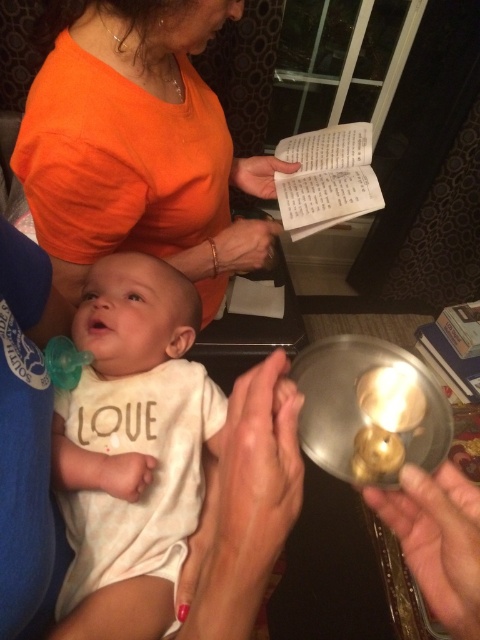
You are a photographer setting up a shot of the scene described. You need to position a light source to the right of the metallic gold ring at lower right to highlight it. Will the light also illuminate the white soft cotton onesie at center?

The white soft cotton onesie at center is to the left of the metallic gold ring at lower right. Since the light is placed to the right of the ring, it may not directly illuminate the onesie unless the light has a wide spread. However, based on their positions, the onesie is on the opposite side of the light relative to the ring, so it might not be well lit by this setup.